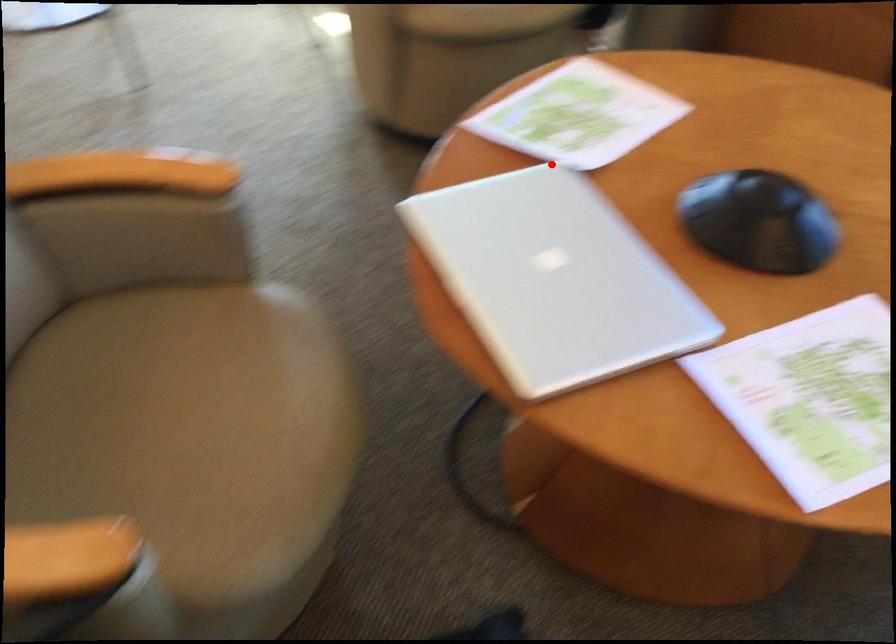
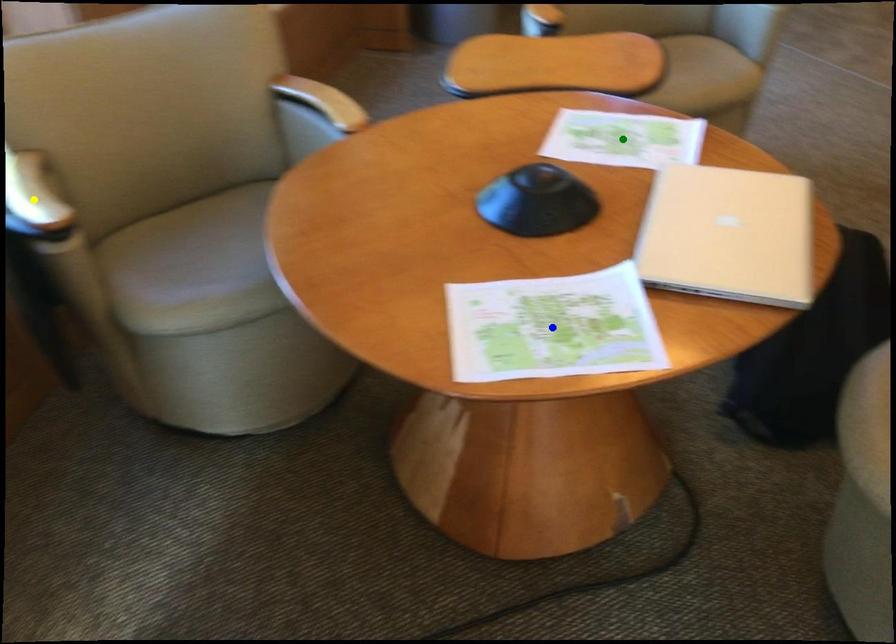
Question: I am providing you with two images of the same scene from different viewpoints. A red point is marked on the first image. You are given multiple points on the second image. Which point in image 2 represents the same 3d spot as the red point in image 1?

Choices:
 (A) green point
 (B) blue point
 (C) yellow point

Answer: (B)